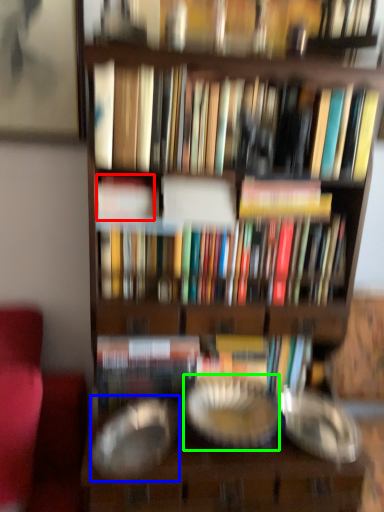
Question: Which object is the farthest from book (highlighted by a red box)? Choose among these: glass plate (highlighted by a blue box) or glass plate (highlighted by a green box).

Choices:
 (A) glass plate
 (B) glass plate

Answer: (B)